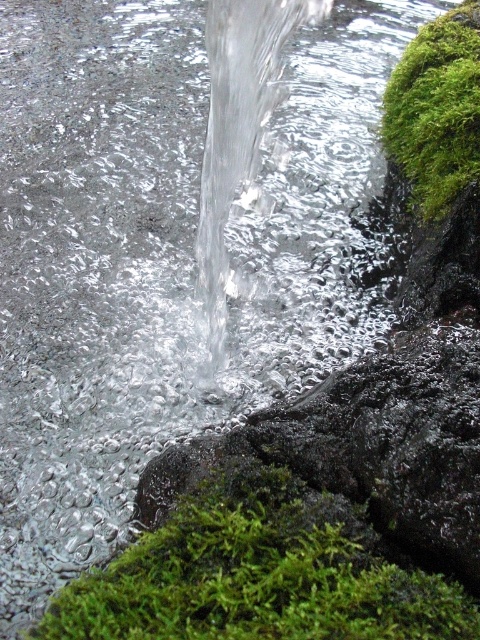
Question: Is green fuzzy moss at lower center behind green fuzzy moss at upper right?

Choices:
 (A) no
 (B) yes

Answer: (A)

Question: Does green fuzzy moss at lower center have a larger size compared to green fuzzy moss at upper right?

Choices:
 (A) no
 (B) yes

Answer: (A)

Question: Among these objects, which one is farthest from the camera?

Choices:
 (A) green fuzzy moss at upper right
 (B) green fuzzy moss at lower center

Answer: (A)

Question: Does green fuzzy moss at lower center appear over green fuzzy moss at upper right?

Choices:
 (A) no
 (B) yes

Answer: (A)